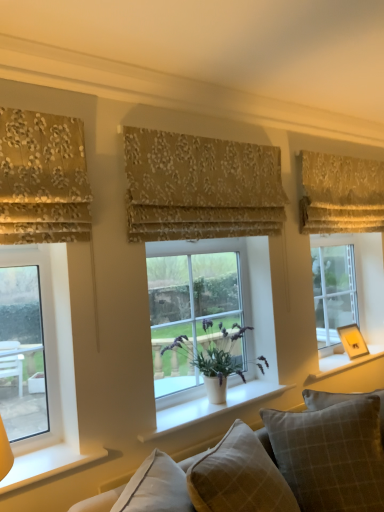
What is the approximate height of beige floral fabric at center, which is counted as the 2th curtain, starting from the left?

22.60 inches.

The image size is (384, 512). Describe the element at coordinates (200, 187) in the screenshot. I see `beige floral fabric at center, acting as the 2th curtain starting from the front` at that location.

The image size is (384, 512). What do you see at coordinates (238, 476) in the screenshot?
I see `plaid fabric pillow at center, marked as the second pillow in a right-to-left arrangement` at bounding box center [238, 476].

Locate an element on the screen. The image size is (384, 512). white painted wood at right, which appears as the first window sill when viewed from the back is located at coordinates (344, 362).

What do you see at coordinates (44, 340) in the screenshot? The image size is (384, 512). I see `clear glass window at left, which is the third window from back to front` at bounding box center [44, 340].

What is the approximate height of white smooth window sill at center, the 2th window sill in the right-to-left sequence?

white smooth window sill at center, the 2th window sill in the right-to-left sequence, is 5.04 centimeters in height.

I want to click on white smooth window sill at lower left, positioned as the 1th window sill in front-to-back order, so click(45, 465).

Looking at this image, which of these two, clear glass window at right, which is counted as the 1th window, starting from the back, or white smooth window sill at center, the second window sill when ordered from front to back, is smaller?

white smooth window sill at center, the second window sill when ordered from front to back.

Is clear glass window at right, the 3th window positioned from the left, looking in the opposite direction of white smooth window sill at center, the second window sill from the left?

No.

From the image's perspective, which is below, clear glass window at right, which is counted as the 1th window, starting from the back, or white smooth window sill at center, the second window sill when ordered from front to back?

white smooth window sill at center, the second window sill when ordered from front to back, from the image's perspective.

Consider the image. Is clear glass window at right, the 3th window from the front, taller or shorter than white smooth window sill at center, the second window sill when ordered from front to back?

clear glass window at right, the 3th window from the front, is taller than white smooth window sill at center, the second window sill when ordered from front to back.

Does point (343, 370) come closer to viewer compared to point (6, 478)?

No, (343, 370) is further to viewer.

Starting from the white painted wood at right, which appears as the first window sill when viewed from the back, which window sill is the 2nd one in front? Please provide its 2D coordinates.

[(45, 465)]

In terms of width, does white painted wood at right, the 3th window sill in the front-to-back sequence, look wider or thinner when compared to white smooth window sill at lower left, which is counted as the 3th window sill, starting from the right?

Clearly, white painted wood at right, the 3th window sill in the front-to-back sequence, has more width compared to white smooth window sill at lower left, which is counted as the 3th window sill, starting from the right.

Does white painted wood at right, the 3th window sill in the front-to-back sequence, turn towards white smooth window sill at lower left, positioned as the 1th window sill in front-to-back order?

No, white painted wood at right, the 3th window sill in the front-to-back sequence, is not turned towards white smooth window sill at lower left, positioned as the 1th window sill in front-to-back order.

Does beige floral fabric at center, acting as the 2th curtain starting from the front, come behind gold floral fabric at upper right, the 3th curtain when ordered from left to right?

No, it is in front of gold floral fabric at upper right, the 3th curtain when ordered from left to right.

From a real-world perspective, is beige floral fabric at center, which is the second curtain in back-to-front order, located higher than gold floral fabric at upper right, which is counted as the first curtain, starting from the right?

No, from a real-world perspective, beige floral fabric at center, which is the second curtain in back-to-front order, is not above gold floral fabric at upper right, which is counted as the first curtain, starting from the right.

Is beige floral fabric at center, which is counted as the 2th curtain, starting from the left, at the left side of gold floral fabric at upper right, which is the 3th curtain from front to back?

Yes.

There is a gold floral fabric at upper left, marked as the first curtain in a left-to-right arrangement. Identify the location of the 1st curtain above it (from the image's perspective). (200, 187).

Is beige floral fabric at center, acting as the 2th curtain starting from the front, in front of or behind gold floral fabric at upper left, marked as the first curtain in a left-to-right arrangement, in the image?

Clearly, beige floral fabric at center, acting as the 2th curtain starting from the front, is behind gold floral fabric at upper left, marked as the first curtain in a left-to-right arrangement.

From the picture: Is beige floral fabric at center, which is the second curtain in back-to-front order, wider or thinner than gold floral fabric at upper left, placed as the 3th curtain when sorted from right to left?

Considering their sizes, beige floral fabric at center, which is the second curtain in back-to-front order, looks slimmer than gold floral fabric at upper left, placed as the 3th curtain when sorted from right to left.

From the image's perspective, is beige floral fabric at center, which is counted as the 2th curtain, starting from the left, above or below gold floral fabric at upper left, the third curtain when ordered from back to front?

beige floral fabric at center, which is counted as the 2th curtain, starting from the left, is situated higher than gold floral fabric at upper left, the third curtain when ordered from back to front, in the image.

Are gold floral fabric at upper right, the 3th curtain when ordered from left to right, and white matte pot at center beside each other?

There is a gap between gold floral fabric at upper right, the 3th curtain when ordered from left to right, and white matte pot at center.

Is gold floral fabric at upper right, which is counted as the first curtain, starting from the right, behind white matte pot at center?

Yes, gold floral fabric at upper right, which is counted as the first curtain, starting from the right, is further from the camera.

Is point (318, 212) in front of point (207, 327)?

No, (318, 212) is behind (207, 327).

From a real-world perspective, is gold floral fabric at upper right, the 1th curtain viewed from the back, on top of white matte pot at center?

Yes, from a real-world perspective, gold floral fabric at upper right, the 1th curtain viewed from the back, is over white matte pot at center

I want to click on houseplant above the white painted wood at right, which appears as the first window sill when viewed from the back (from the image's perspective), so click(x=213, y=357).

Is white painted wood at right, which appears as the first window sill when viewed from the back, not close to white matte pot at center?

That's not correct — white painted wood at right, which appears as the first window sill when viewed from the back, is a little close to white matte pot at center.

Is white painted wood at right, which is counted as the 3th window sill, starting from the left, situated inside white matte pot at center or outside?

white painted wood at right, which is counted as the 3th window sill, starting from the left, cannot be found inside white matte pot at center.

Is white painted wood at right, which appears as the first window sill when viewed from the back, facing away from white matte pot at center?

No, white painted wood at right, which appears as the first window sill when viewed from the back, is not facing the opposite direction of white matte pot at center.

Considering the positions of objects textured beige cushions at lower center and white smooth window sill at center, the 2th window sill in the right-to-left sequence, in the image provided, who is more to the left, textured beige cushions at lower center or white smooth window sill at center, the 2th window sill in the right-to-left sequence,?

white smooth window sill at center, the 2th window sill in the right-to-left sequence.

Could you measure the distance between textured beige cushions at lower center and white smooth window sill at center, the second window sill when ordered from front to back?

17.45 inches.

Considering the positions of objects textured beige cushions at lower center and white smooth window sill at center, the second window sill from the left, in the image provided, who is in front, textured beige cushions at lower center or white smooth window sill at center, the second window sill from the left,?

textured beige cushions at lower center is more forward.

From a real-world perspective, starting from the white smooth window sill at center, placed as the second window sill when sorted from back to front, which window is the 1st one vertically above it? Please provide its 2D coordinates.

[(351, 286)]

This screenshot has height=512, width=384. I want to click on the 2nd window sill below the white painted wood at right, the 3th window sill in the front-to-back sequence (from the image's perspective), so click(x=45, y=465).

Which object lies further to the anchor point plaid fabric pillow at center, arranged as the first pillow when viewed from the left, textured beige cushions at lower center or white painted wood at right, which appears as the first window sill when viewed from the back?

white painted wood at right, which appears as the first window sill when viewed from the back, lies further to plaid fabric pillow at center, arranged as the first pillow when viewed from the left, than the other object.

Estimate the real-world distances between objects in this image. Which object is further from plaid fabric pillow at lower right, which is counted as the first pillow, starting from the right, white painted wood at right, which is counted as the 3th window sill, starting from the left, or gold floral fabric at upper left, the first curtain when ordered from front to back?

gold floral fabric at upper left, the first curtain when ordered from front to back, lies further to plaid fabric pillow at lower right, which is counted as the first pillow, starting from the right, than the other object.

Considering their positions, is white painted wood at right, the first window sill when ordered from right to left, positioned further to gold floral fabric at upper left, marked as the first curtain in a left-to-right arrangement, than white smooth window sill at lower left, positioned as the 1th window sill in front-to-back order?

white painted wood at right, the first window sill when ordered from right to left, is positioned further to the anchor gold floral fabric at upper left, marked as the first curtain in a left-to-right arrangement.

When comparing their distances from white smooth window sill at center, the second window sill when ordered from front to back, does clear glass window at left, which appears as the first window when viewed from the left, or gold floral fabric at upper left, placed as the 3th curtain when sorted from right to left, seem closer?

Based on the image, clear glass window at left, which appears as the first window when viewed from the left, appears to be nearer to white smooth window sill at center, the second window sill when ordered from front to back.

Looking at the image, which one is located closer to white smooth window sill at center, placed as the second window sill when sorted from back to front, plaid fabric pillow at center, marked as the second pillow in a right-to-left arrangement, or white smooth window sill at lower left, the 3th window sill viewed from the back?

plaid fabric pillow at center, marked as the second pillow in a right-to-left arrangement, is closer to white smooth window sill at center, placed as the second window sill when sorted from back to front.

Consider the image. Based on their spatial positions, is translucent glass window at center, which appears as the second window when viewed from the back, or plaid fabric pillow at center, arranged as the first pillow when viewed from the left, closer to plaid fabric pillow at lower right, positioned as the second pillow in left-to-right order?

plaid fabric pillow at center, arranged as the first pillow when viewed from the left, lies closer to plaid fabric pillow at lower right, positioned as the second pillow in left-to-right order, than the other object.

Estimate the real-world distances between objects in this image. Which object is closer to gold floral fabric at upper left, marked as the first curtain in a left-to-right arrangement, plaid fabric pillow at center, arranged as the first pillow when viewed from the left, or plaid fabric pillow at lower right, which is counted as the first pillow, starting from the right?

plaid fabric pillow at center, arranged as the first pillow when viewed from the left, is closer to gold floral fabric at upper left, marked as the first curtain in a left-to-right arrangement.

Looking at the image, which one is located further to white matte pot at center, plaid fabric pillow at lower right, positioned as the second pillow in left-to-right order, or white painted wood at right, the 3th window sill in the front-to-back sequence?

white painted wood at right, the 3th window sill in the front-to-back sequence, is further to white matte pot at center.

Locate an element on the screen. This screenshot has height=512, width=384. houseplant between gold floral fabric at upper right, the 3th curtain when ordered from left to right, and plaid fabric pillow at center, marked as the second pillow in a right-to-left arrangement, from top to bottom is located at coordinates (213, 357).

The height and width of the screenshot is (512, 384). What are the coordinates of `window sill between gold floral fabric at upper right, which is counted as the first curtain, starting from the right, and white smooth window sill at center, placed as the second window sill when sorted from back to front, vertically` in the screenshot? It's located at (344, 362).

Identify the location of houseplant between textured beige cushions at lower center and translucent glass window at center, which appears as the second window when viewed from the back, in the front-back direction. The height and width of the screenshot is (512, 384). (213, 357).

Identify the location of curtain that lies between beige floral fabric at center, acting as the 2th curtain starting from the front, and textured beige cushions at lower center from top to bottom. The width and height of the screenshot is (384, 512). (42, 178).